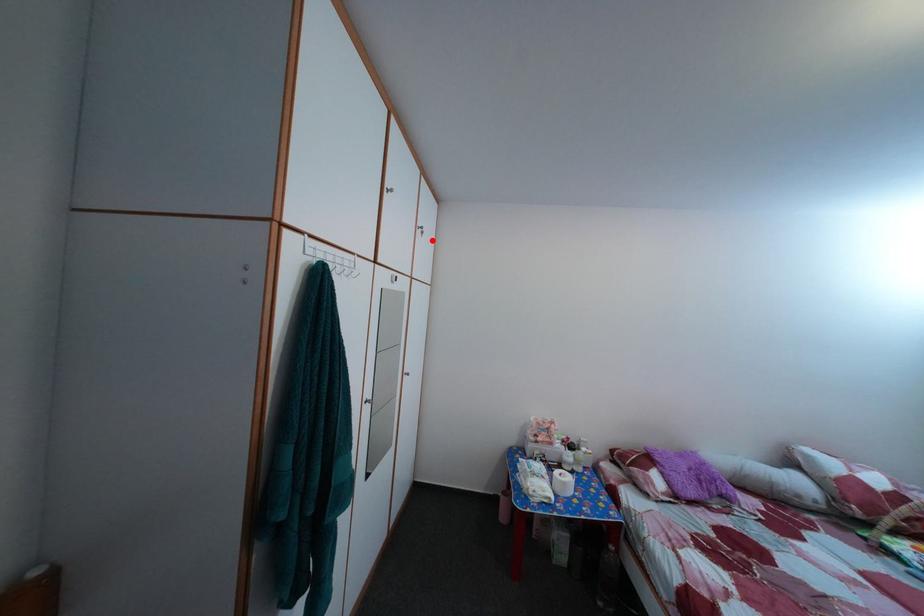
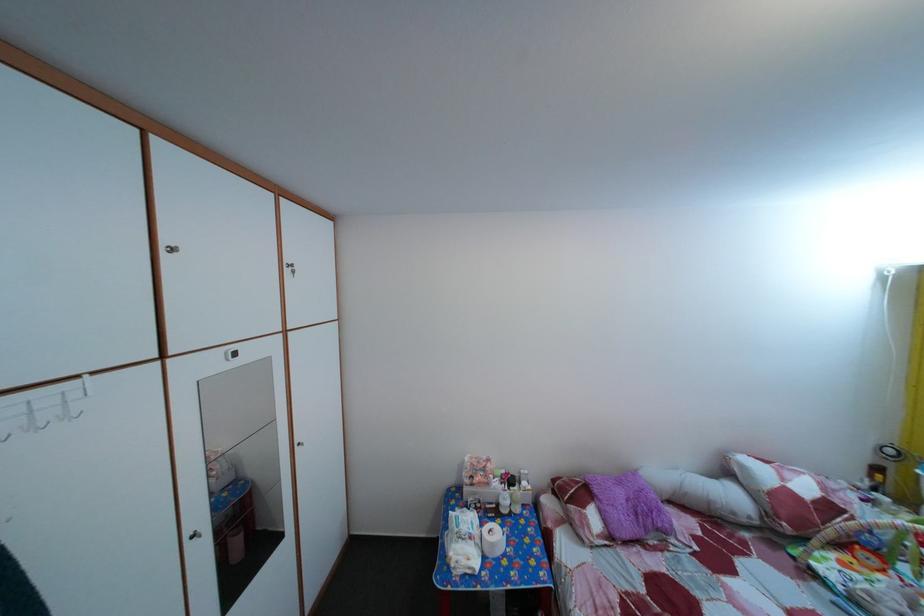
The point at the highlighted location is marked in the first image. Where is the corresponding point in the second image?

(304, 280)